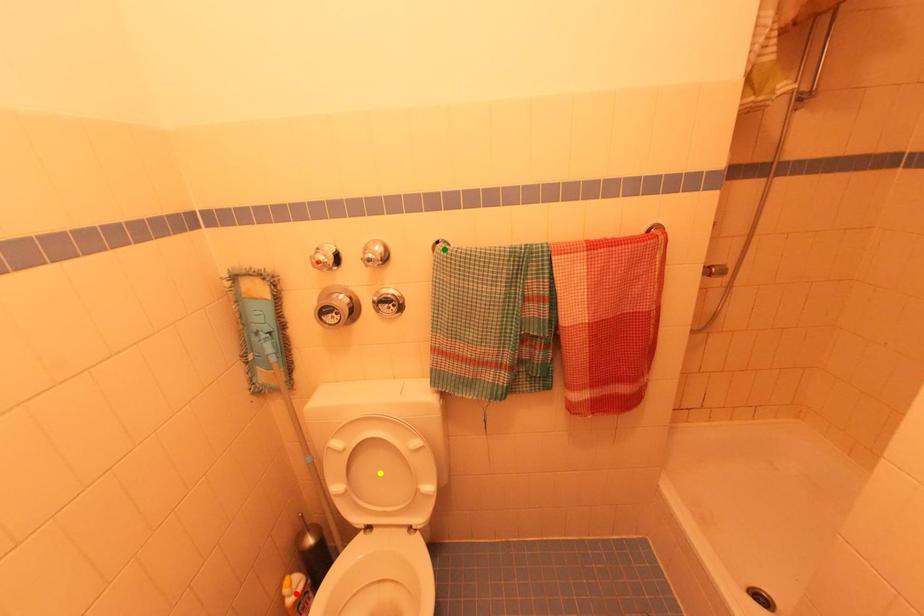
Order these from nearest to farthest:
- yellow point
- green point
- red point

1. red point
2. yellow point
3. green point